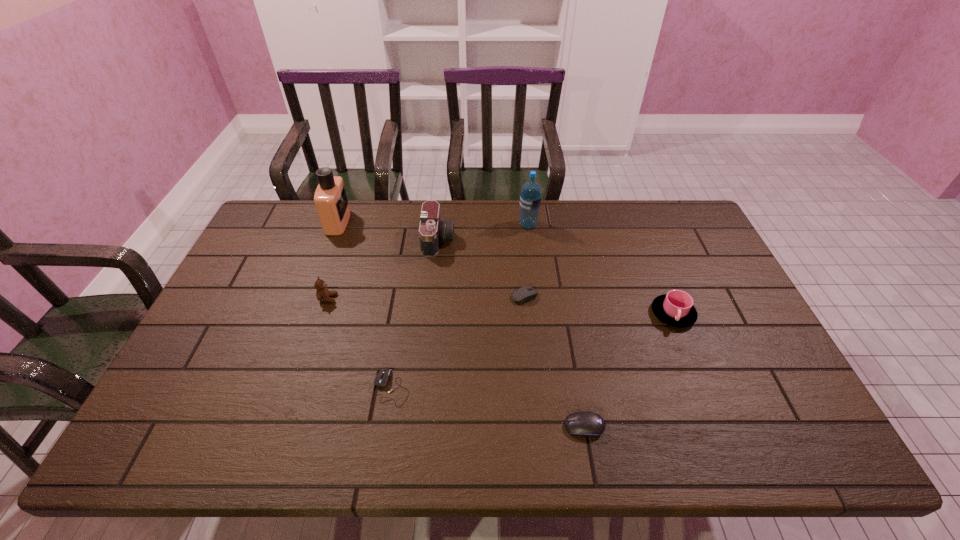
Find the location of `perfume that is at the far edge`. perfume that is at the far edge is located at coordinates [x=331, y=201].

Locate an element on the screen. camera located in the far edge section of the desktop is located at coordinates (432, 230).

The image size is (960, 540). I want to click on object that is at the near edge, so [x=586, y=423].

Locate an element on the screen. object that is at the right edge is located at coordinates (675, 308).

In the image, there is a desktop. Where is `vacant area at the far edge`? vacant area at the far edge is located at coordinates (516, 206).

In the image, there is a desktop. At what (x,y) coordinates should I click in order to perform the action: click on vacant space at the left edge. Please return your answer as a coordinate pair (x, y). Looking at the image, I should click on (251, 309).

Where is `free space at the right edge`? free space at the right edge is located at coordinates (727, 287).

This screenshot has width=960, height=540. I want to click on free space at the far left corner, so click(265, 231).

The height and width of the screenshot is (540, 960). Find the location of `empty space between the leftmost computer mouse and the second computer mouse from left to right`. empty space between the leftmost computer mouse and the second computer mouse from left to right is located at coordinates (458, 342).

Find the location of a particular element. This screenshot has width=960, height=540. empty space that is in between the fifth tallest object and the second nearest computer mouse is located at coordinates (533, 350).